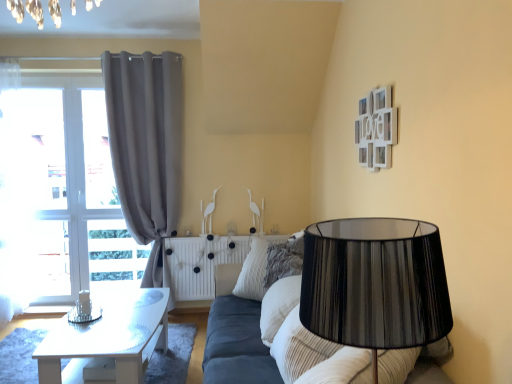
Question: Does striped fabric pillow at center contain white glossy table at left?

Choices:
 (A) no
 (B) yes

Answer: (A)

Question: Does striped fabric pillow at center turn towards white glossy table at left?

Choices:
 (A) yes
 (B) no

Answer: (B)

Question: Does striped fabric pillow at center have a greater width compared to white glossy table at left?

Choices:
 (A) yes
 (B) no

Answer: (B)

Question: Are striped fabric pillow at center and white glossy table at left making contact?

Choices:
 (A) no
 (B) yes

Answer: (A)

Question: Does striped fabric pillow at center have a smaller size compared to white glossy table at left?

Choices:
 (A) yes
 (B) no

Answer: (A)

Question: Is striped fabric pillow at center in front of or behind white glossy table at left in the image?

Choices:
 (A) behind
 (B) front

Answer: (A)

Question: Is striped fabric pillow at center taller or shorter than white glossy table at left?

Choices:
 (A) short
 (B) tall

Answer: (A)

Question: In terms of size, does striped fabric pillow at center appear bigger or smaller than white glossy table at left?

Choices:
 (A) small
 (B) big

Answer: (A)

Question: Do you think striped fabric pillow at center is within white glossy table at left, or outside of it?

Choices:
 (A) outside
 (B) inside

Answer: (A)

Question: Would you say striped fabric pillow at center is to the left or to the right of white textured radiator at center in the picture?

Choices:
 (A) right
 (B) left

Answer: (A)

Question: Considering the positions of striped fabric pillow at center and white textured radiator at center in the image, is striped fabric pillow at center taller or shorter than white textured radiator at center?

Choices:
 (A) short
 (B) tall

Answer: (A)

Question: Is striped fabric pillow at center spatially inside white textured radiator at center, or outside of it?

Choices:
 (A) outside
 (B) inside

Answer: (A)

Question: From a real-world perspective, is striped fabric pillow at center physically located above or below white textured radiator at center?

Choices:
 (A) above
 (B) below

Answer: (A)

Question: Considering the positions of white glossy table at left and striped fabric pillow at center in the image, is white glossy table at left bigger or smaller than striped fabric pillow at center?

Choices:
 (A) small
 (B) big

Answer: (B)

Question: Does point 131,354 appear closer or farther from the camera than point 295,258?

Choices:
 (A) closer
 (B) farther

Answer: (A)